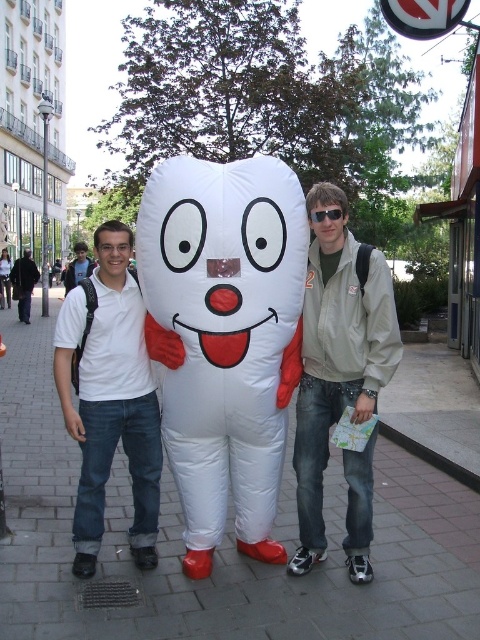
You are trying to decide which item is wider between the brushed metal backpack at left and the white matte shirt at center. Which one is wider?

A: The white matte shirt at center is wider than the brushed metal backpack at left.